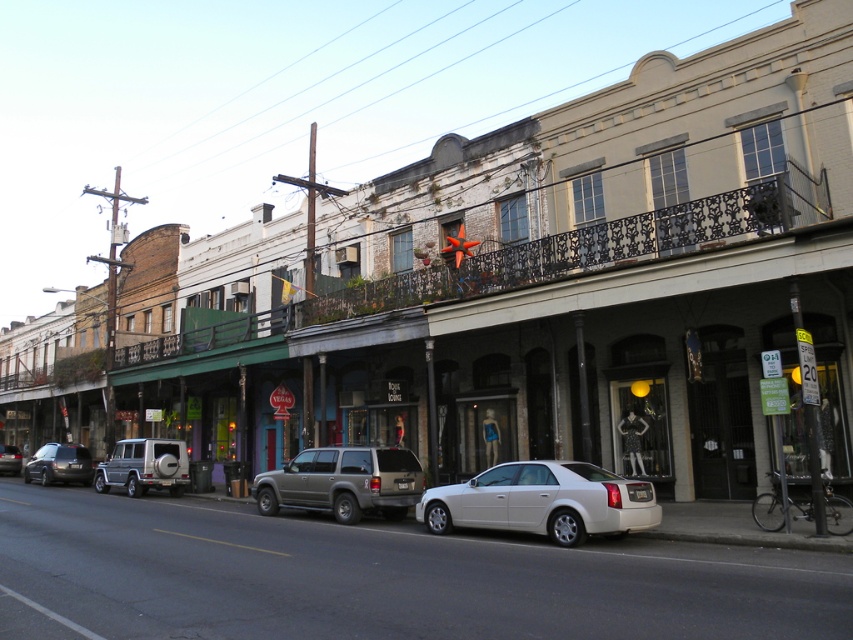
You are a delivery driver who needs to park your vehicle between the white glossy sedan at center and the matte black suv at left. Your delivery van is 5 meters long. Can you fit your van between them?

The white glossy sedan at center is smaller than the matte black suv at left, but the distance between them isn generated from the description. The answer cannot be determined based on the provided information.

You are a delivery driver who needs to park your 5.5 meter long truck between the two vehicles on the street. The vehicles are a white sedan and a matte black suv at left. Can you fit your truck between them without overlapping either vehicle?

The distance between the white sedan and the matte black suv at left is 28.84 meters. Since your truck is only 5.5 meters long, there is more than enough space to park between them without overlapping either vehicle.

You are standing on the sidewalk in front of the historic buildings and want to take a photo that includes both the ornate balcony on the right and the green awning storefront. To ensure both are in focus, you need to know which of the two points, point 1 at coordinates (306, 484) or point 2 at coordinates (167, 456), is closer to you. Which point is closer?

Point 1 at coordinates (306, 484) is closer to the camera than point 2 at coordinates (167, 456). Therefore, to ensure both the ornate balcony and the green awning are in focus, you should adjust your camera settings to account for the distance difference between these two points.